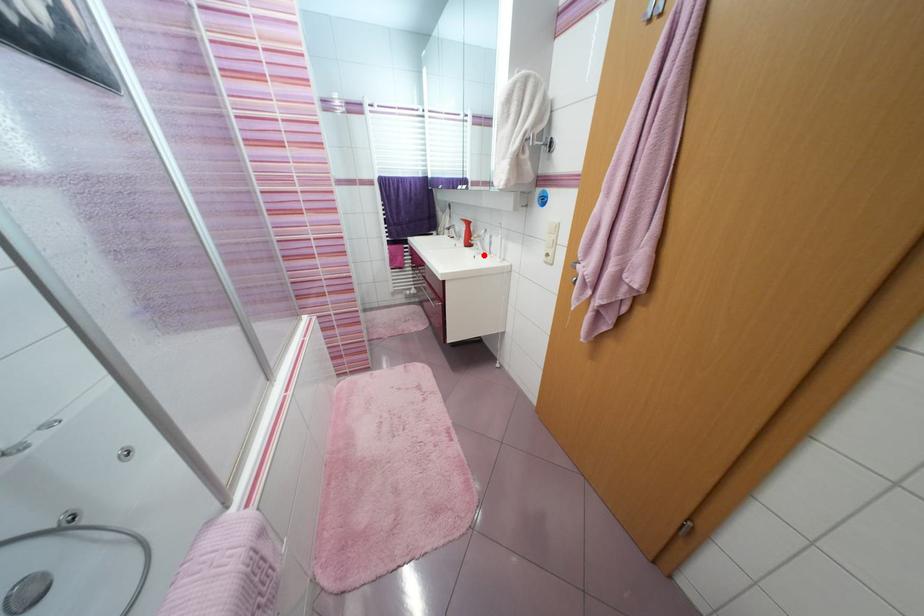
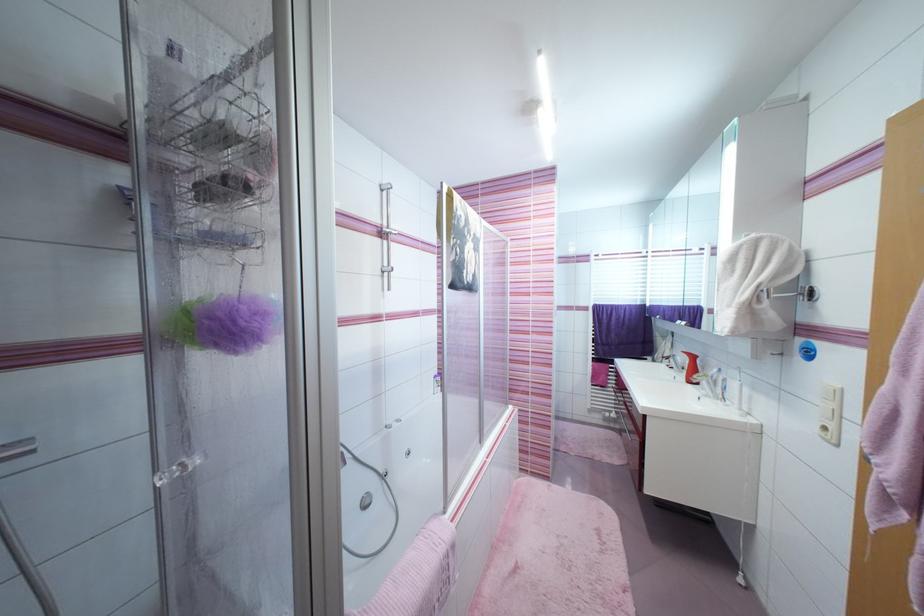
The point at the highlighted location is marked in the first image. Where is the corresponding point in the second image?

(711, 398)